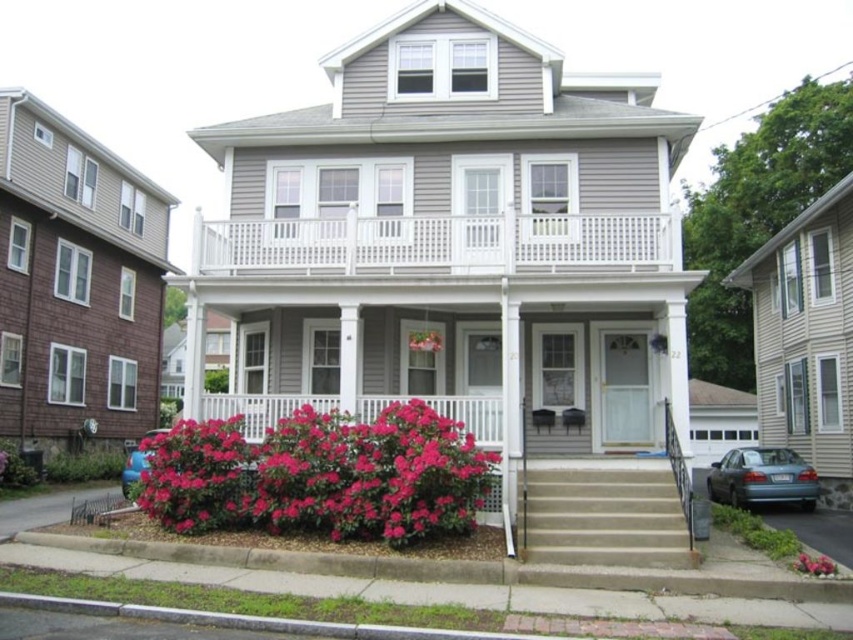
You are a delivery person approaching the house and need to place a package on the porch. There is a vivid pink petals at lower center and a teal metallic sedan at lower right in your view. Which object is closer to you as you stand at the base of the steps?

The vivid pink petals at lower center is closer to you because it is in front of the teal metallic sedan at lower right, meaning it is positioned nearer to your current location at the base of the steps.

You are standing in front of the house and want to take a photo. There are two points marked on the house facade. The first point is at coordinates point (x=730, y=461) and the second is at point (x=161, y=433). Which point will appear larger in your photo?

Point (x=730, y=461) is closer to the camera than point (x=161, y=433). Since objects closer to the camera appear larger in a photo, the point at (x=730, y=461) will appear larger in the photo.

You are standing at the base of the steps leading to the house. There is a point marked at coordinates point (144, 472). Can you reach that point without moving past the steps?

The point (144, 472) is 11.61 meters away from the viewer. Since the steps are part of the porch leading up to the house, the distance is too great to reach that point without moving past the steps.